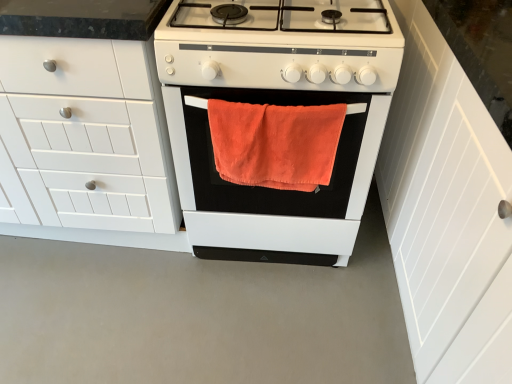
Question: Considering the relative sizes of white matte cabinet at left, arranged as the first cabinetry when viewed from the left, and white matte oven at center in the image provided, is white matte cabinet at left, arranged as the first cabinetry when viewed from the left, shorter than white matte oven at center?

Choices:
 (A) no
 (B) yes

Answer: (A)

Question: Considering the relative sizes of white matte cabinet at left, acting as the 2th cabinetry starting from the right, and white matte oven at center in the image provided, is white matte cabinet at left, acting as the 2th cabinetry starting from the right, smaller than white matte oven at center?

Choices:
 (A) no
 (B) yes

Answer: (A)

Question: Considering the relative positions of white matte cabinet at left, acting as the 2th cabinetry starting from the right, and white matte oven at center in the image provided, is white matte cabinet at left, acting as the 2th cabinetry starting from the right, behind white matte oven at center?

Choices:
 (A) yes
 (B) no

Answer: (B)

Question: Is white matte cabinet at left, acting as the 2th cabinetry starting from the right, not inside white matte oven at center?

Choices:
 (A) no
 (B) yes

Answer: (B)

Question: Does white matte cabinet at left, arranged as the first cabinetry when viewed from the left, have a greater width compared to white matte oven at center?

Choices:
 (A) yes
 (B) no

Answer: (B)

Question: Is point (285, 213) closer or farther from the camera than point (480, 163)?

Choices:
 (A) farther
 (B) closer

Answer: (A)

Question: In the image, is orange cotton towel at center positioned in front of or behind white wood cabinet at right, marked as the 2th cabinetry in a left-to-right arrangement?

Choices:
 (A) front
 (B) behind

Answer: (B)

Question: Considering the positions of orange cotton towel at center and white wood cabinet at right, marked as the 2th cabinetry in a left-to-right arrangement, in the image, is orange cotton towel at center taller or shorter than white wood cabinet at right, marked as the 2th cabinetry in a left-to-right arrangement,?

Choices:
 (A) tall
 (B) short

Answer: (B)

Question: Is orange cotton towel at center situated inside white wood cabinet at right, marked as the 2th cabinetry in a left-to-right arrangement, or outside?

Choices:
 (A) outside
 (B) inside

Answer: (A)

Question: In the image, is white wood cabinet at right, marked as the 2th cabinetry in a left-to-right arrangement, on the left side or the right side of white matte oven at center?

Choices:
 (A) right
 (B) left

Answer: (A)

Question: In terms of height, does white wood cabinet at right, which is counted as the first cabinetry, starting from the right, look taller or shorter compared to white matte oven at center?

Choices:
 (A) tall
 (B) short

Answer: (A)

Question: Is white wood cabinet at right, marked as the 2th cabinetry in a left-to-right arrangement, inside the boundaries of white matte oven at center, or outside?

Choices:
 (A) outside
 (B) inside

Answer: (A)

Question: From the image's perspective, is white wood cabinet at right, which is counted as the first cabinetry, starting from the right, positioned above or below white matte oven at center?

Choices:
 (A) above
 (B) below

Answer: (B)

Question: Would you say white wood cabinet at right, which is counted as the first cabinetry, starting from the right, is to the left or to the right of white matte gas stove at center in the picture?

Choices:
 (A) left
 (B) right

Answer: (B)

Question: Is white wood cabinet at right, marked as the 2th cabinetry in a left-to-right arrangement, bigger or smaller than white matte gas stove at center?

Choices:
 (A) small
 (B) big

Answer: (B)